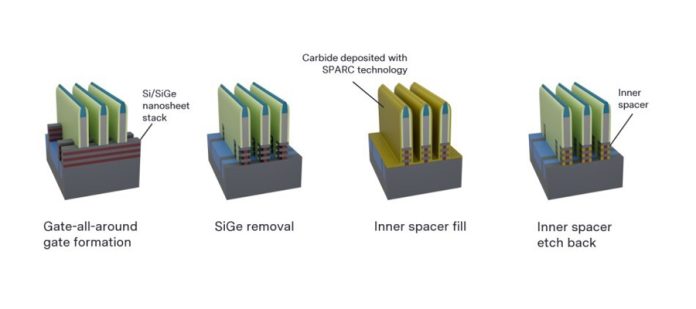
Locate an element on the screen. The height and width of the screenshot is (309, 696). green folders is located at coordinates (63, 118), (94, 106), (108, 102), (225, 108), (244, 97), (257, 91), (555, 134), (578, 111), (596, 105).